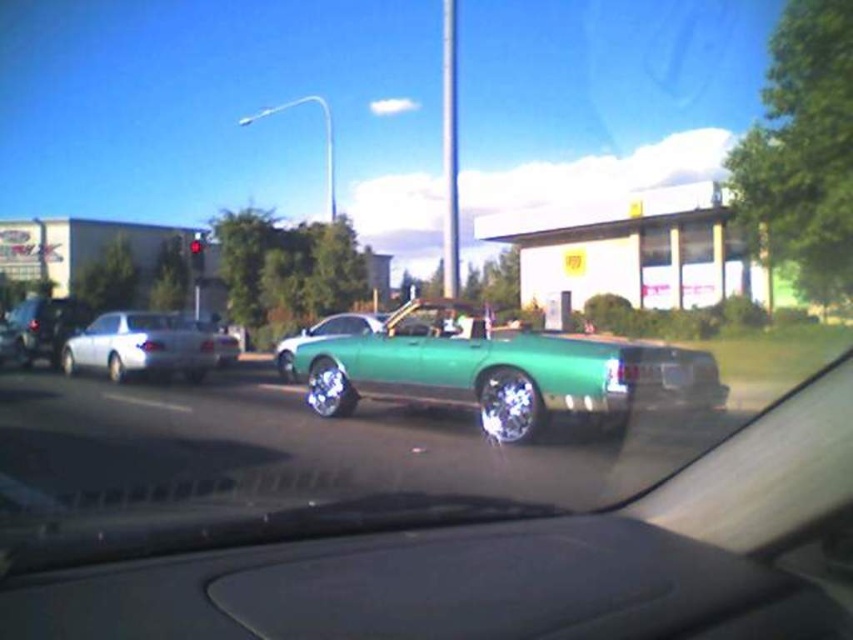
You are a driver in the white glossy sedan at center. You need to park your car in a parking spot that can only accommodate vehicles smaller than the shiny green car at center. Can you park your car there?

The white glossy sedan at center is larger than the shiny green car at center, so it cannot fit into the parking spot designed for smaller vehicles.

You are a passenger in the car and looking out the window. You see a white glossy sedan at center and a shiny green car at center. Which car is closer to you?

The white glossy sedan at center is closer to you because it is further to the viewer than the shiny green car at center.

You are a passenger in the vehicle and want to check the speed on the black matte dashboard at center while looking at the shiny green car at center. Can you see the dashboard without moving your head?

The black matte dashboard at center is located below the shiny green car at center, so you can see it without moving your head as it is positioned lower in your field of view.